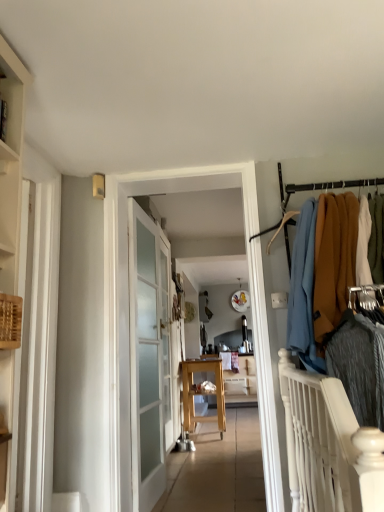
Question: Is wooden table at center outside of wooden table at center?

Choices:
 (A) no
 (B) yes

Answer: (B)

Question: Is wooden table at center closer to the viewer compared to wooden table at center?

Choices:
 (A) no
 (B) yes

Answer: (A)

Question: Is wooden table at center far from wooden table at center?

Choices:
 (A) no
 (B) yes

Answer: (B)

Question: From a real-world perspective, is wooden table at center over wooden table at center?

Choices:
 (A) no
 (B) yes

Answer: (B)

Question: Is wooden table at center completely or partially inside wooden table at center?

Choices:
 (A) yes
 (B) no

Answer: (B)

Question: From the image's perspective, is wooden shelf at left positioned above or below clear glass door at center?

Choices:
 (A) below
 (B) above

Answer: (B)

Question: In the image, is wooden shelf at left positioned in front of or behind clear glass door at center?

Choices:
 (A) behind
 (B) front

Answer: (B)

Question: Is wooden shelf at left inside or outside of clear glass door at center?

Choices:
 (A) outside
 (B) inside

Answer: (A)

Question: Considering the positions of wooden shelf at left and clear glass door at center in the image, is wooden shelf at left wider or thinner than clear glass door at center?

Choices:
 (A) thin
 (B) wide

Answer: (A)

Question: Considering the relative positions of wooden table at center and white frosted glass door at center in the image provided, is wooden table at center to the left or to the right of white frosted glass door at center?

Choices:
 (A) left
 (B) right

Answer: (B)

Question: Considering the positions of wooden table at center and white frosted glass door at center in the image, is wooden table at center wider or thinner than white frosted glass door at center?

Choices:
 (A) thin
 (B) wide

Answer: (B)

Question: In terms of size, does wooden table at center appear bigger or smaller than white frosted glass door at center?

Choices:
 (A) small
 (B) big

Answer: (B)

Question: Is wooden table at center inside the boundaries of white frosted glass door at center, or outside?

Choices:
 (A) inside
 (B) outside

Answer: (B)

Question: Based on their positions, is white frosted glass door at center located to the left or right of wooden table at center?

Choices:
 (A) left
 (B) right

Answer: (A)

Question: From the image's perspective, is white frosted glass door at center positioned above or below wooden table at center?

Choices:
 (A) above
 (B) below

Answer: (A)